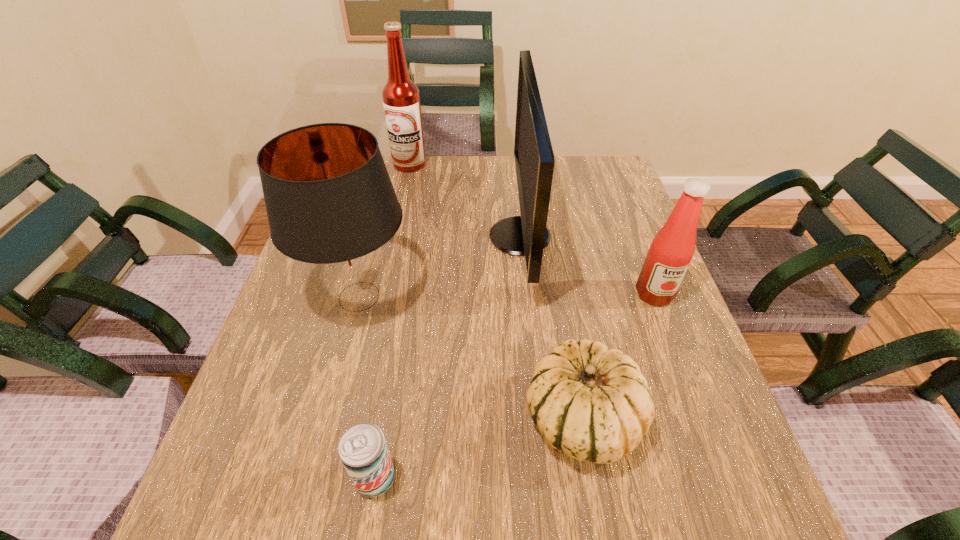
This screenshot has height=540, width=960. I want to click on free spot located 0.250m on the front-facing side of the computer monitor, so click(x=395, y=237).

This screenshot has width=960, height=540. I want to click on vacant space located on the back of the lampshade, so click(384, 203).

Where is `vacant space located 0.260m on the front-facing side of the third shortest object`? The width and height of the screenshot is (960, 540). vacant space located 0.260m on the front-facing side of the third shortest object is located at coordinates (701, 416).

This screenshot has height=540, width=960. What are the coordinates of `vacant space located 0.340m on the back of the fifth tallest object` in the screenshot? It's located at (554, 255).

You are a GUI agent. You are given a task and a screenshot of the screen. Output one action in this format:
    pyautogui.click(x=<x>, y=<y>)
    Task: Click on the vacant space located on the right of the beer can
    The image size is (960, 540).
    Given the screenshot: What is the action you would take?
    pyautogui.click(x=627, y=477)

Locate an element on the screen. The width and height of the screenshot is (960, 540). alcohol present at the far edge is located at coordinates (401, 98).

This screenshot has width=960, height=540. What are the coordinates of `computer monitor at the far edge` in the screenshot? It's located at (527, 234).

Image resolution: width=960 pixels, height=540 pixels. Identify the location of object located at the near edge. (363, 450).

Identify the location of alcohol that is at the left edge. This screenshot has height=540, width=960. (401, 98).

You are a GUI agent. You are given a task and a screenshot of the screen. Output one action in this format:
    pyautogui.click(x=<x>, y=<y>)
    Task: Click on the lampshade present at the left edge
    The width and height of the screenshot is (960, 540).
    Given the screenshot: What is the action you would take?
    pyautogui.click(x=331, y=206)